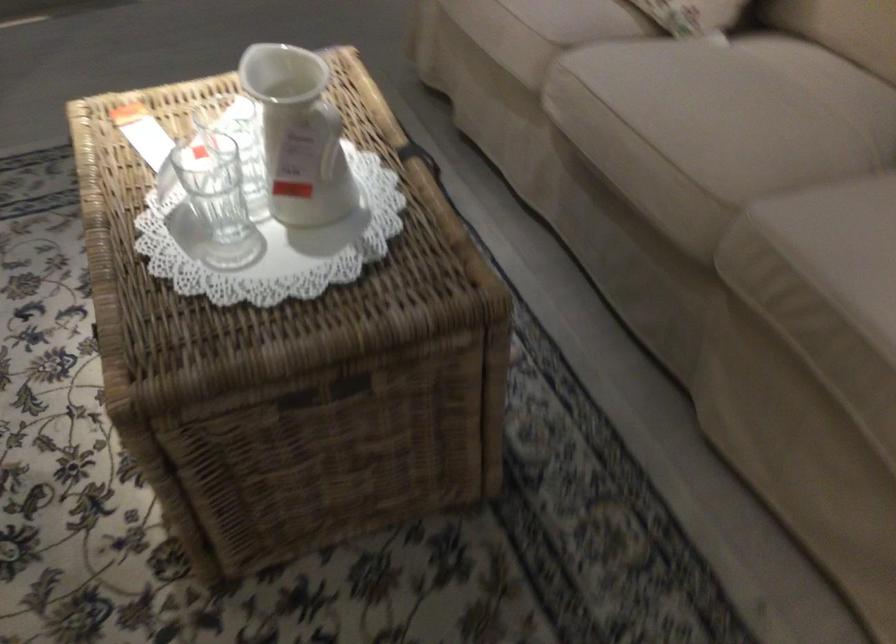
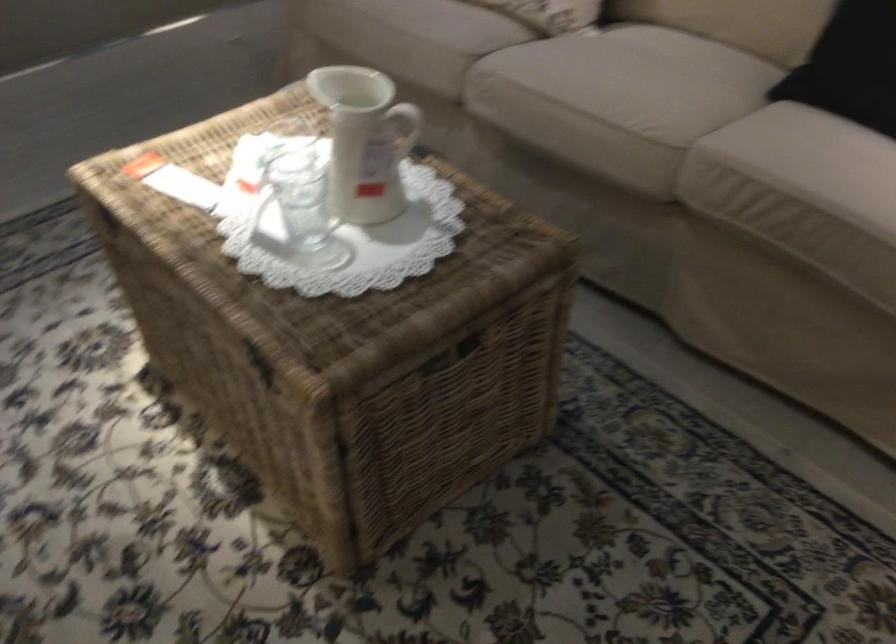
Where in the second image is the point corresponding to (x=688, y=120) from the first image?

(617, 93)